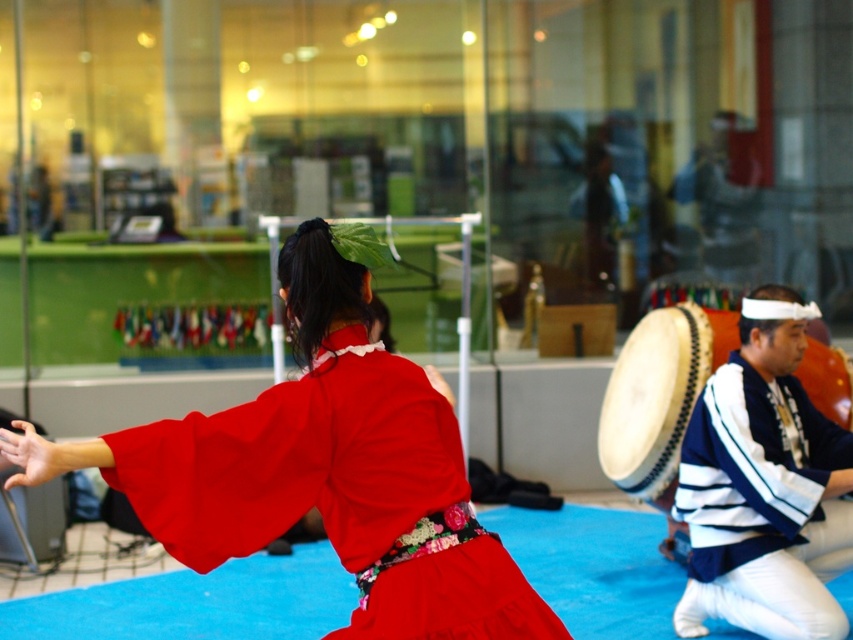
Question: Does matte red kimono at center appear over white striped shirt at right?

Choices:
 (A) no
 (B) yes

Answer: (B)

Question: Which object is closer to the camera taking this photo?

Choices:
 (A) white textured drum at right
 (B) matte red kimono at center

Answer: (B)

Question: Which point is closer to the camera?

Choices:
 (A) white textured drum at right
 (B) white striped shirt at right
 (C) matte red kimono at center

Answer: (C)

Question: Among these points, which one is farthest from the camera?

Choices:
 (A) (796, 538)
 (B) (706, 342)

Answer: (B)

Question: Can you confirm if white striped shirt at right is thinner than white textured drum at right?

Choices:
 (A) no
 (B) yes

Answer: (A)

Question: Can you confirm if matte red kimono at center is positioned above white textured drum at right?

Choices:
 (A) yes
 (B) no

Answer: (A)